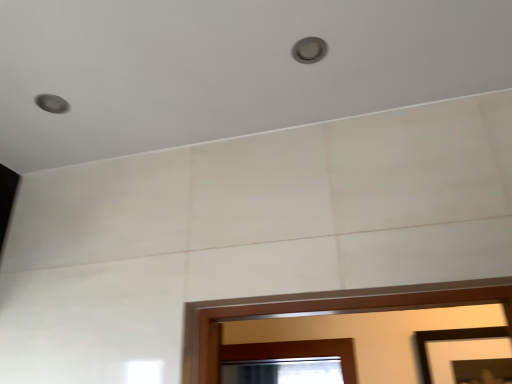
This screenshot has height=384, width=512. What do you see at coordinates (451, 339) in the screenshot?
I see `black matte picture frame at lower right` at bounding box center [451, 339].

Locate an element on the screen. black matte picture frame at lower right is located at coordinates coord(451,339).

Locate an element on the screen. matte silver light at upper center is located at coordinates (309, 50).

What is the approximate width of matte silver light at upper center?

3.35 inches.

Image resolution: width=512 pixels, height=384 pixels. What do you see at coordinates (309, 50) in the screenshot? I see `matte silver light at upper center` at bounding box center [309, 50].

Identify the location of black matte picture frame at lower right. The height and width of the screenshot is (384, 512). (451, 339).

Can you confirm if matte silver light at upper center is positioned to the left of black matte picture frame at lower right?

Correct, you'll find matte silver light at upper center to the left of black matte picture frame at lower right.

Is matte silver light at upper center behind black matte picture frame at lower right?

No, it is not.

Does point (309, 43) come behind point (421, 345)?

That is False.

From the image's perspective, which one is positioned higher, matte silver light at upper center or black matte picture frame at lower right?

From the image's view, matte silver light at upper center is above.

From a real-world perspective, between matte silver light at upper center and black matte picture frame at lower right, who is vertically lower?

In real-world perspective, black matte picture frame at lower right is lower.

Considering the sizes of objects matte silver light at upper center and black matte picture frame at lower right in the image provided, who is wider, matte silver light at upper center or black matte picture frame at lower right?

matte silver light at upper center is wider.

Does matte silver light at upper center have a lesser height compared to black matte picture frame at lower right?

Indeed, matte silver light at upper center has a lesser height compared to black matte picture frame at lower right.

Considering the sizes of matte silver light at upper center and black matte picture frame at lower right in the image, is matte silver light at upper center bigger or smaller than black matte picture frame at lower right?

matte silver light at upper center is smaller than black matte picture frame at lower right.

Choose the correct answer: Is matte silver light at upper center inside black matte picture frame at lower right or outside it?

matte silver light at upper center is outside black matte picture frame at lower right.

Does matte silver light at upper center touch black matte picture frame at lower right?

No, matte silver light at upper center is not beside black matte picture frame at lower right.

Is matte silver light at upper center positioned with its back to black matte picture frame at lower right?

matte silver light at upper center does not have its back to black matte picture frame at lower right.

Image resolution: width=512 pixels, height=384 pixels. Identify the location of light located above the black matte picture frame at lower right (from a real-world perspective). (309, 50).

Does black matte picture frame at lower right appear on the left side of matte silver light at upper center?

No, black matte picture frame at lower right is not to the left of matte silver light at upper center.

Is black matte picture frame at lower right closer to camera compared to matte silver light at upper center?

No, the depth of black matte picture frame at lower right is greater than that of matte silver light at upper center.

Is point (417, 348) less distant than point (296, 60)?

No.

Looking at this image, from the image's perspective, is black matte picture frame at lower right above or below matte silver light at upper center?

black matte picture frame at lower right is situated lower than matte silver light at upper center in the image.

From a real-world perspective, is black matte picture frame at lower right on top of matte silver light at upper center?

Incorrect, from a real-world perspective, black matte picture frame at lower right is lower than matte silver light at upper center.

Does black matte picture frame at lower right have a greater width compared to matte silver light at upper center?

No, black matte picture frame at lower right is not wider than matte silver light at upper center.

Considering the sizes of objects black matte picture frame at lower right and matte silver light at upper center in the image provided, who is taller, black matte picture frame at lower right or matte silver light at upper center?

Standing taller between the two is black matte picture frame at lower right.

From the picture: Is black matte picture frame at lower right bigger than matte silver light at upper center?

Indeed, black matte picture frame at lower right has a larger size compared to matte silver light at upper center.

Is black matte picture frame at lower right positioned beyond the bounds of matte silver light at upper center?

Yes, black matte picture frame at lower right is outside of matte silver light at upper center.

Are black matte picture frame at lower right and matte silver light at upper center located far from each other?

Yes, black matte picture frame at lower right and matte silver light at upper center are quite far apart.

Is black matte picture frame at lower right positioned with its back to matte silver light at upper center?

That's not correct — black matte picture frame at lower right is not looking away from matte silver light at upper center.

Identify the location of light lying in front of the black matte picture frame at lower right. The height and width of the screenshot is (384, 512). (309, 50).

At what (x,y) coordinates should I click in order to perform the action: click on light in front of the black matte picture frame at lower right. Please return your answer as a coordinate pair (x, y). Image resolution: width=512 pixels, height=384 pixels. Looking at the image, I should click on (309, 50).

Where is `light above the black matte picture frame at lower right (from the image's perspective)`? The height and width of the screenshot is (384, 512). light above the black matte picture frame at lower right (from the image's perspective) is located at coordinates (309, 50).